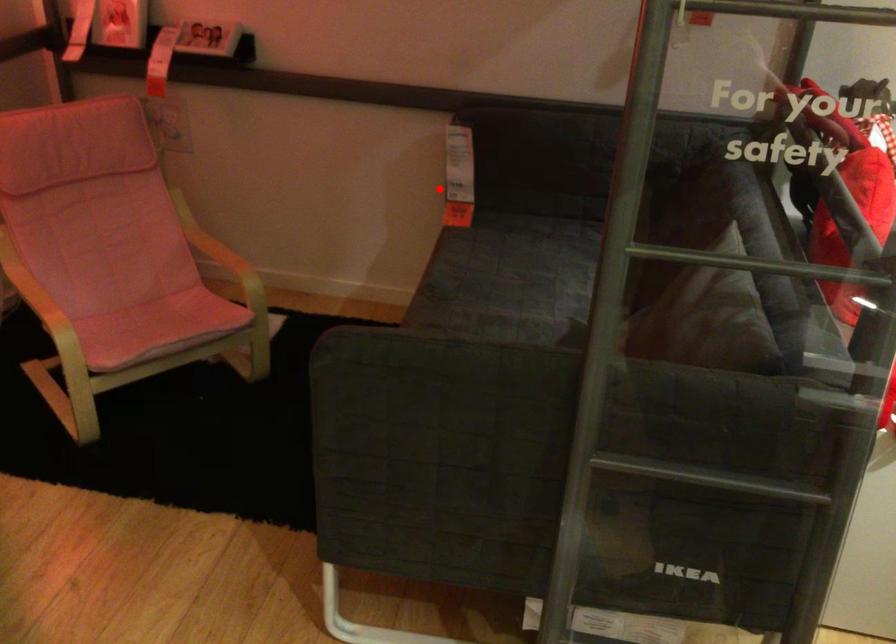
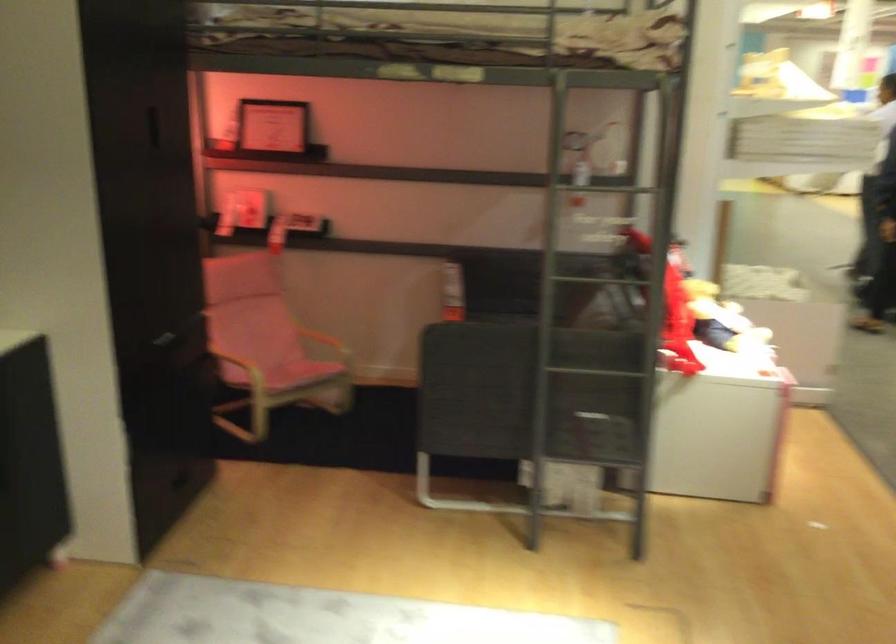
In the second image, find the point that corresponds to the highlighted location in the first image.

(452, 292)